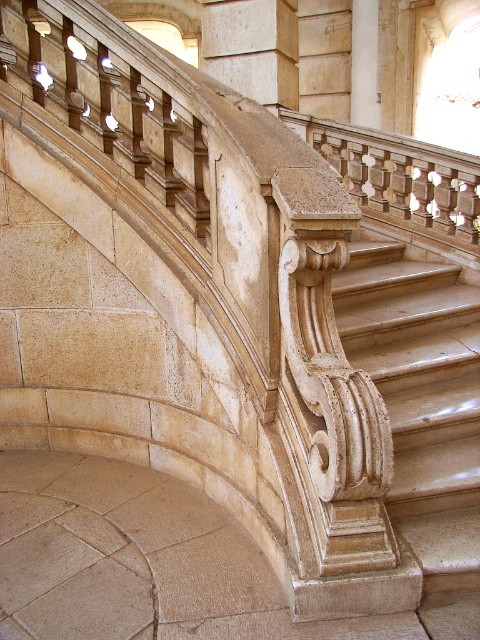
In order to click on polished beige marble stairs at center in this screenshot , I will do point(423,412).

Which is behind, point (342, 273) or point (203, 13)?

Positioned behind is point (203, 13).

This screenshot has width=480, height=640. What are the coordinates of `polished beige marble stairs at center` in the screenshot? It's located at (423, 412).